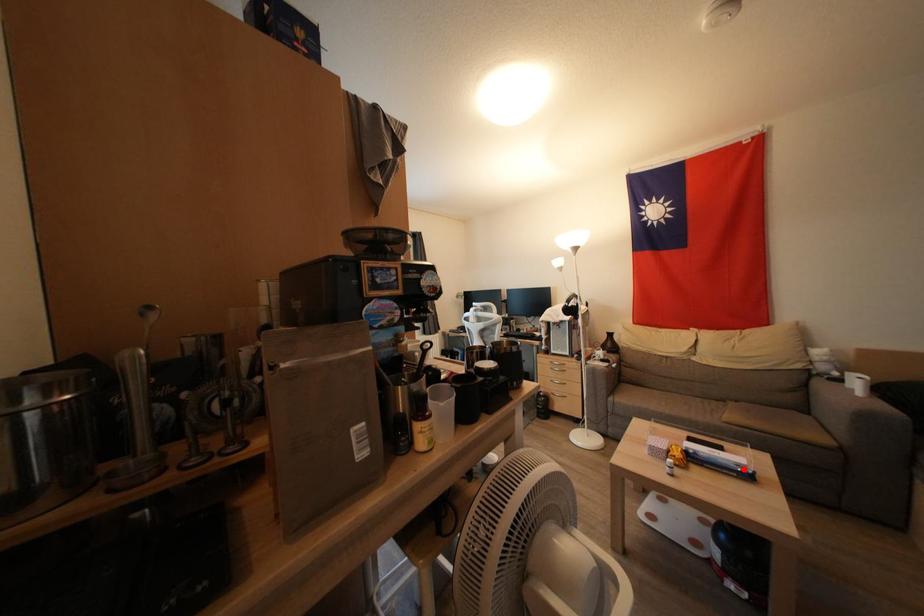
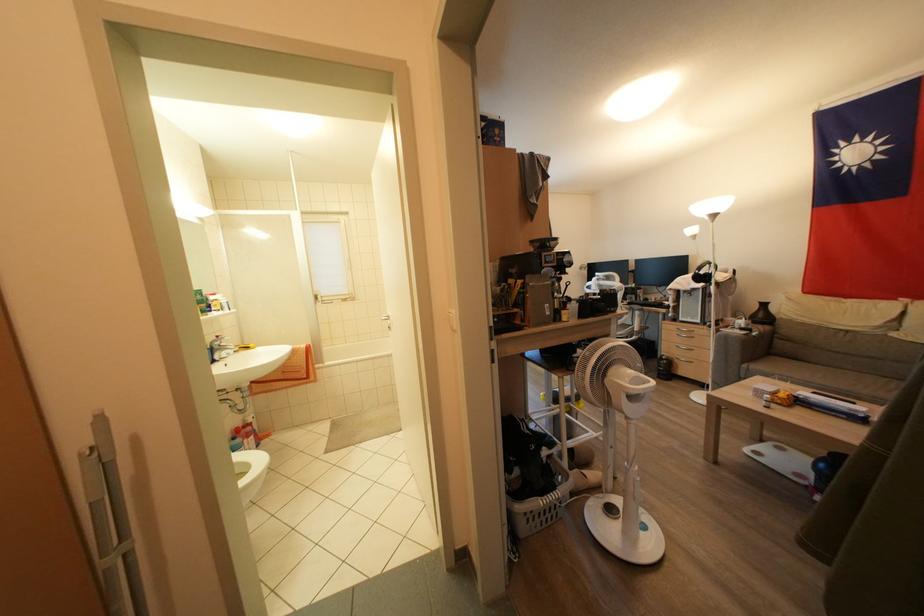
Question: I am providing you with two images of the same scene from different viewpoints. A red point is shown in image1. For the corresponding object point in image2, is it positioned nearer or farther from the camera?

Choices:
 (A) Nearer
 (B) Farther

Answer: (B)